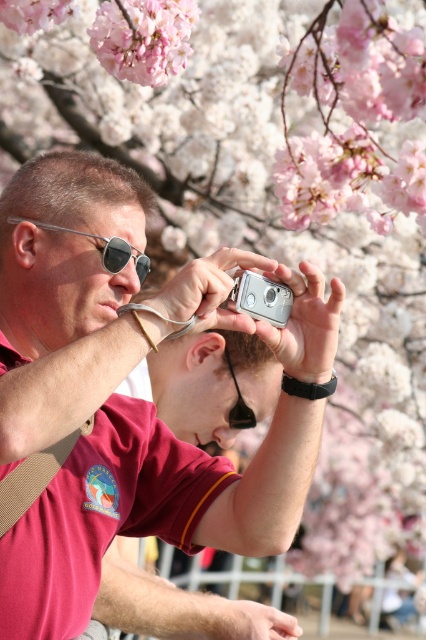
Question: Can you confirm if silver metallic camera at center is smaller than black rubber goggles at center?

Choices:
 (A) yes
 (B) no

Answer: (A)

Question: Estimate the real-world distances between objects in this image. Which object is farther from the pink matte flower at upper left?

Choices:
 (A) silver metallic camera at center
 (B) black rubber goggles at center
 (C) metallic reflective sunglasses at center

Answer: (A)

Question: Does metallic reflective sunglasses at center lie behind black rubber goggles at center?

Choices:
 (A) no
 (B) yes

Answer: (A)

Question: In this image, where is silver metallic camera at center located relative to metallic reflective sunglasses at center?

Choices:
 (A) left
 (B) right

Answer: (B)

Question: Among these points, which one is farthest from the camera?

Choices:
 (A) (14, 625)
 (B) (115, 268)

Answer: (B)

Question: Which point appears farthest from the camera in this image?

Choices:
 (A) (120, 253)
 (B) (26, 340)
 (C) (276, 324)

Answer: (A)